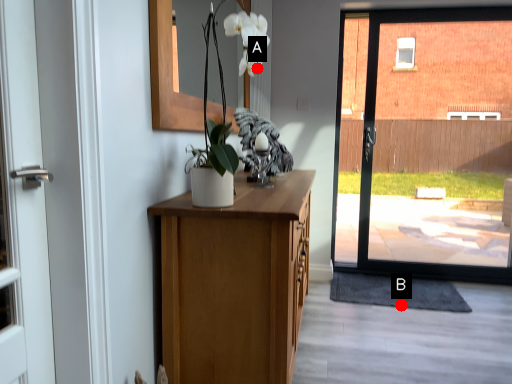
Question: Two points are circled on the image, labeled by A and B beside each circle. Which of the following is the closest to the observer?

Choices:
 (A) A is closer
 (B) B is closer

Answer: (A)